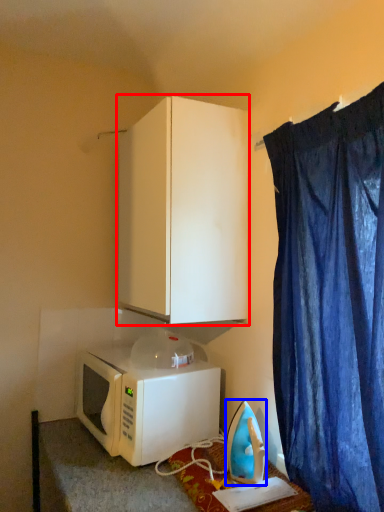
Question: Which point is closer to the camera, cabinetry (highlighted by a red box) or appliance (highlighted by a blue box)?

Choices:
 (A) cabinetry
 (B) appliance

Answer: (B)